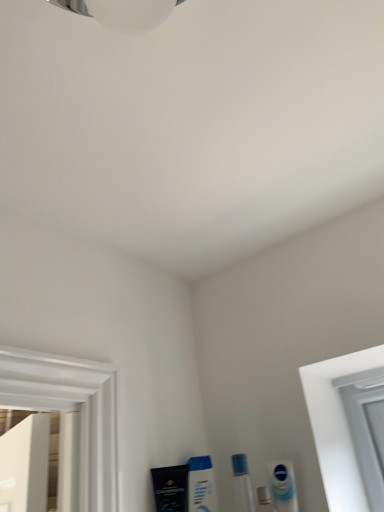
Question: In terms of size, does white glossy mouthwash at lower center, the third mouthwash viewed from the right, appear bigger or smaller than transparent plastic vial at lower center?

Choices:
 (A) small
 (B) big

Answer: (B)

Question: Would you say white glossy mouthwash at lower center, the second mouthwash in the left-to-right sequence, is to the left or to the right of transparent plastic vial at lower center in the picture?

Choices:
 (A) right
 (B) left

Answer: (B)

Question: Considering the real-world distances, which object is closest to the white glossy mouthwash at lower center, the second mouthwash in the left-to-right sequence?

Choices:
 (A) black matte tube at lower left, acting as the first mouthwash starting from the left
 (B) silver metallic mouthwash at lower center, the second mouthwash viewed from the right
 (C) white glossy tube at lower right, which is the fourth mouthwash from left to right
 (D) transparent plastic vial at lower center

Answer: (A)

Question: Based on their relative distances, which object is farther from the silver metallic mouthwash at lower center, the second mouthwash viewed from the right?

Choices:
 (A) transparent plastic vial at lower center
 (B) white glossy tube at lower right, which is the fourth mouthwash from left to right
 (C) white glossy mouthwash at lower center, the third mouthwash viewed from the right
 (D) black matte tube at lower left, acting as the first mouthwash starting from the left

Answer: (D)